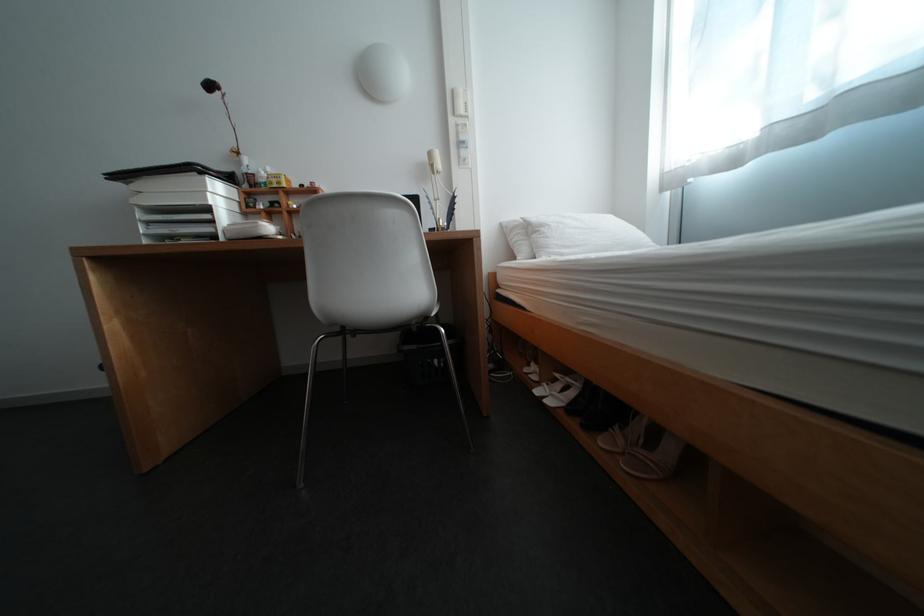
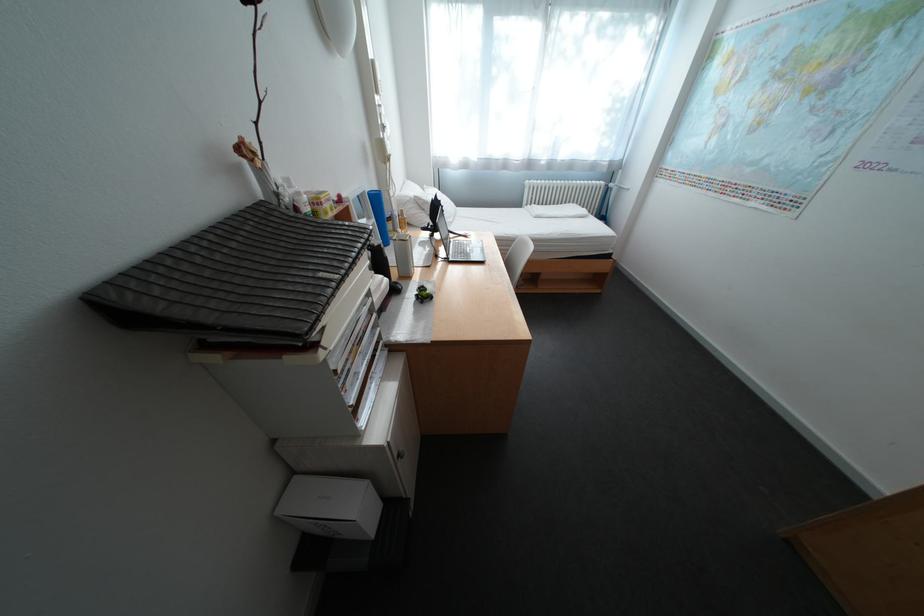
In the second image, find the point that corresponds to point (529, 225) in the first image.

(420, 200)